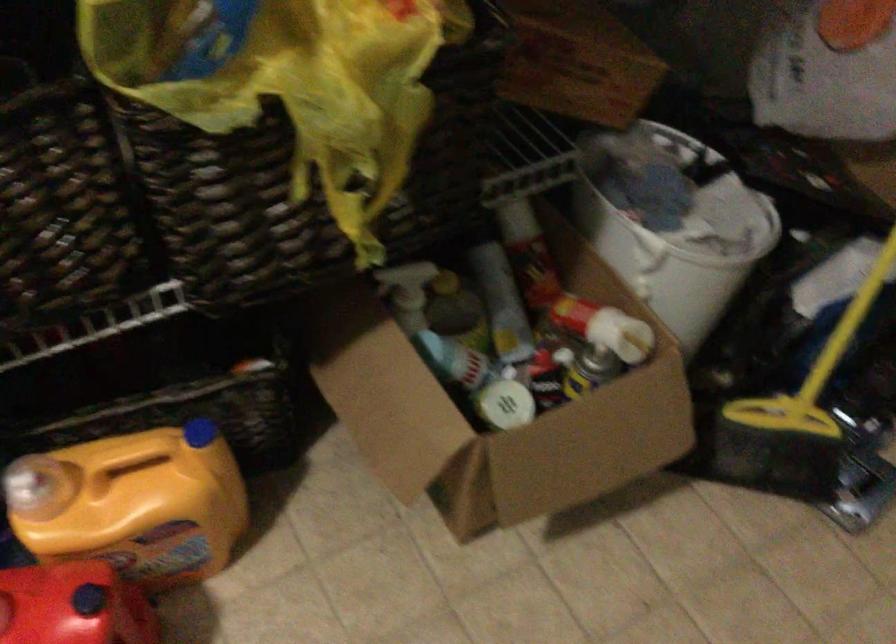
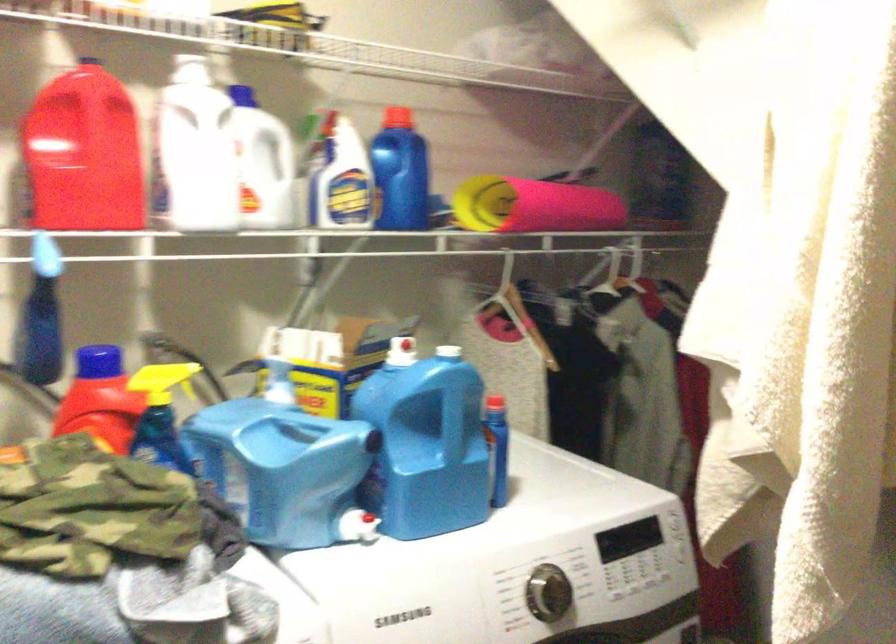
Question: The images are taken continuously from a first-person perspective. In which direction is your viewpoint rotating?

Choices:
 (A) Left
 (B) Right
 (C) Up
 (D) Down

Answer: (A)